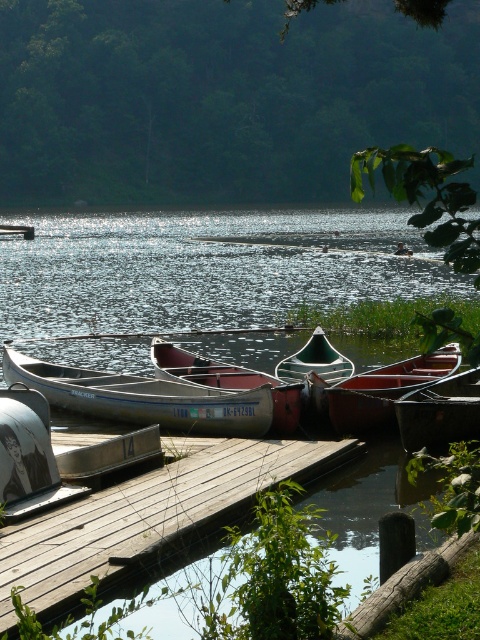
You are standing at the edge of the lake and want to locate two specific points marked in the image. Which of the two points, point 1 at coordinates point (67, 561) or point 2 at coordinates point (176, 362), is closer to you?

Point 1 at coordinates point (67, 561) is closer to you than point 2 at coordinates point (176, 362).

You are standing on the lakeside dock and want to locate two points marked in the scene. Which point, point 1 at coordinates (406, 218) or point 2 at coordinates (302, 374), is closer to you?

Point 2 at coordinates (302, 374) is closer to you because it is nearer to the camera than point 1 at coordinates (406, 218).